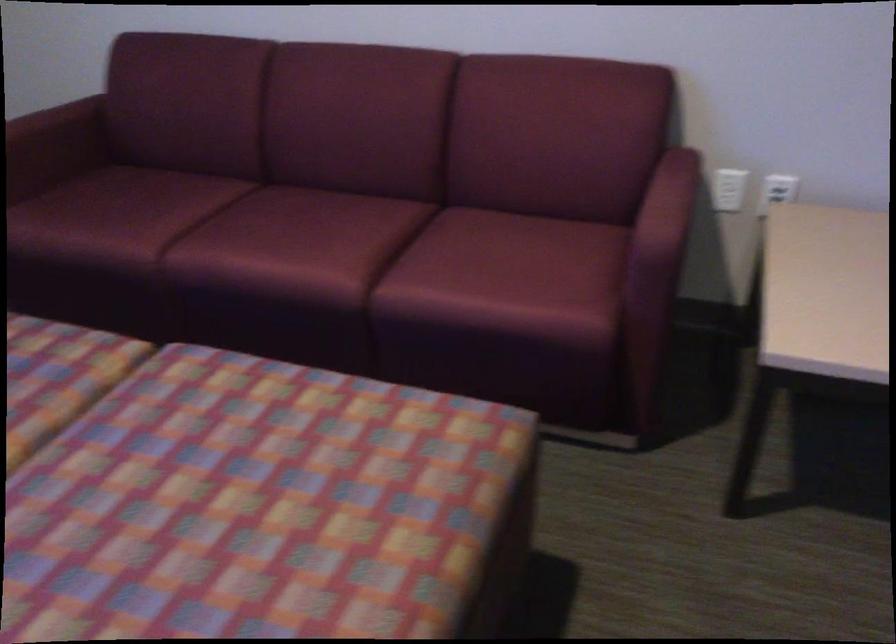
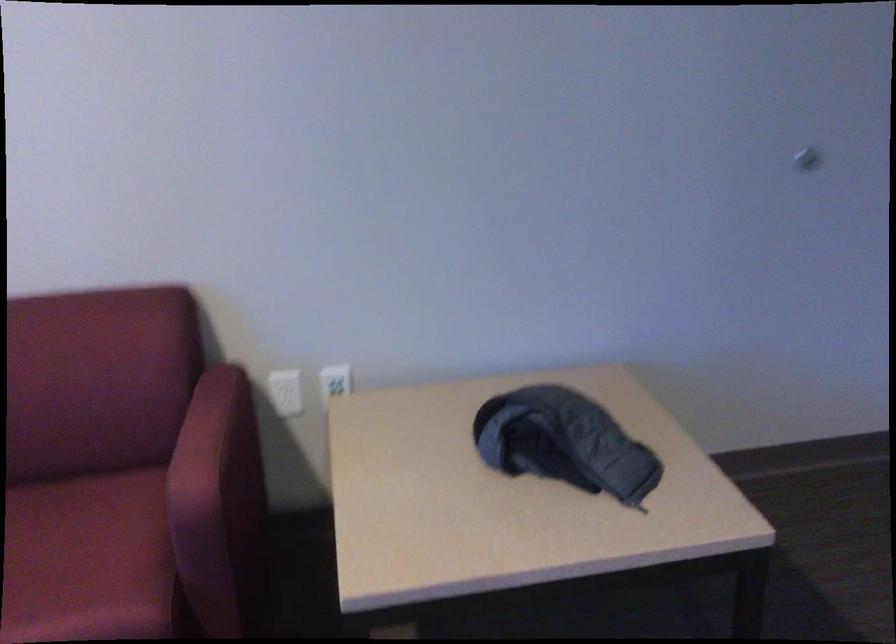
Where in the second image is the point corresponding to pixel 664 249 from the first image?

(204, 504)